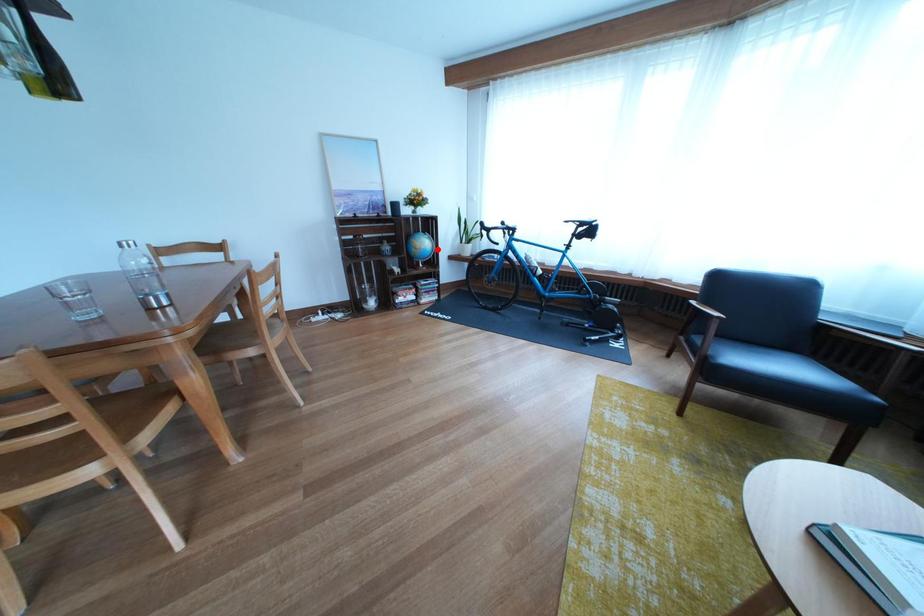
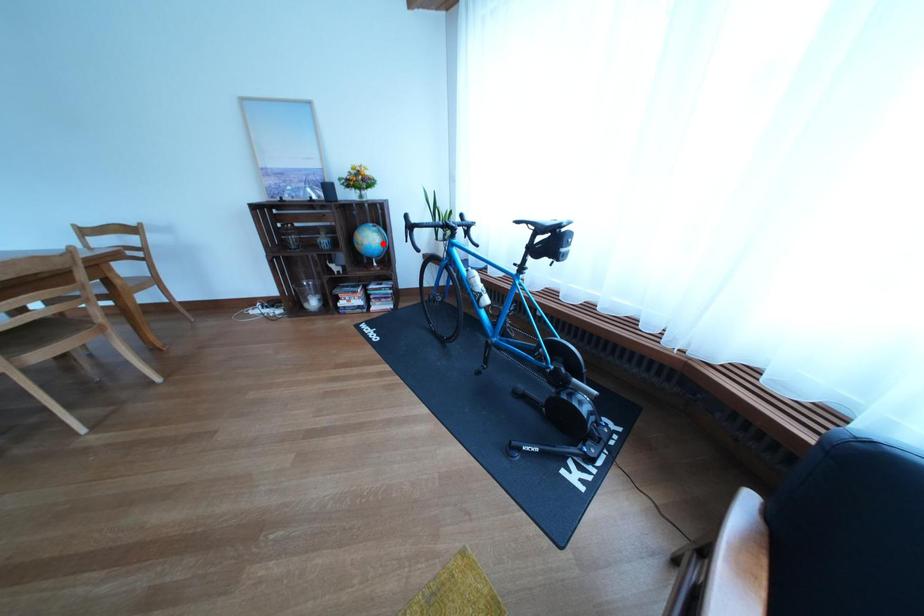
I am providing you with two images of the same scene from different viewpoints. A red point is marked on the first image and another point is marked on the second image. Is the red point in image1 aligned with the point shown in image2?

Yes